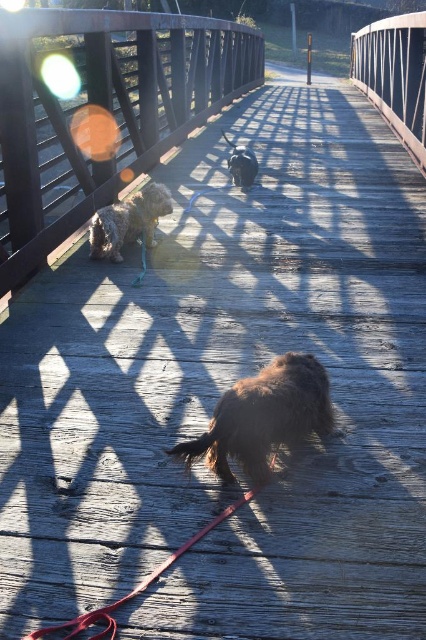
Image resolution: width=426 pixels, height=640 pixels. What do you see at coordinates (132, 588) in the screenshot? I see `red leather leash at lower center` at bounding box center [132, 588].

Who is more forward, (109, 630) or (250, 176)?

Point (109, 630) is more forward.

Locate an element on the screen. red leather leash at lower center is located at coordinates (132, 588).

In the scene shown: Is brown furry dog at center thinner than fuzzy brown dog at center?

No, brown furry dog at center is not thinner than fuzzy brown dog at center.

Is point (199, 456) less distant than point (103, 250)?

Yes, it is in front of point (103, 250).

Where is `brown furry dog at center`? brown furry dog at center is located at coordinates (264, 417).

Where is `brown furry dog at center`? Image resolution: width=426 pixels, height=640 pixels. brown furry dog at center is located at coordinates (264, 417).

Does brown furry dog at center appear on the right side of red leather leash at lower center?

Correct, you'll find brown furry dog at center to the right of red leather leash at lower center.

Is point (299, 440) positioned in front of point (57, 634)?

That is False.

Identify the location of brown furry dog at center. Image resolution: width=426 pixels, height=640 pixels. (264, 417).